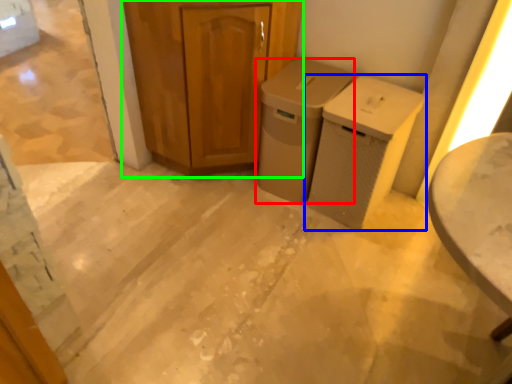
Question: Estimate the real-world distances between objects in this image. Which object is closer to waste container (highlighted by a red box), waste container (highlighted by a blue box) or cabinetry (highlighted by a green box)?

Choices:
 (A) waste container
 (B) cabinetry

Answer: (A)